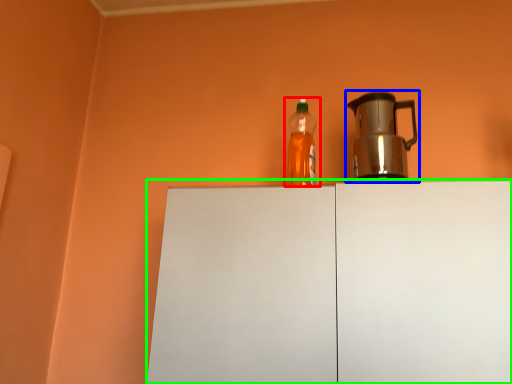
Question: Which object is positioned farthest from bottle (highlighted by a red box)? Select from kettle (highlighted by a blue box) and cabinetry (highlighted by a green box).

Choices:
 (A) kettle
 (B) cabinetry

Answer: (B)